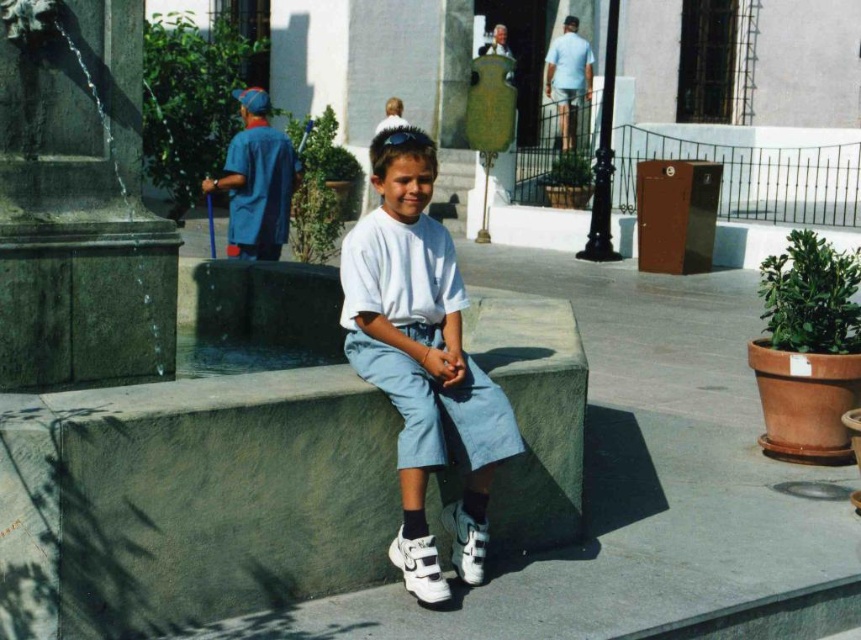
Question: Which object is positioned farthest from the white leather shoe at lower center?

Choices:
 (A) white suede sneaker at lower center
 (B) white matte shorts at center

Answer: (A)

Question: Which object appears farthest from the camera in this image?

Choices:
 (A) white matte shorts at center
 (B) white suede sneaker at lower center
 (C) white leather shoe at lower center

Answer: (B)

Question: Can you confirm if green stone pillar at left is positioned to the left of white suede sneaker at lower center?

Choices:
 (A) yes
 (B) no

Answer: (A)

Question: Is white leather shoe at lower center to the left of white suede sneaker at lower center from the viewer's perspective?

Choices:
 (A) yes
 (B) no

Answer: (A)

Question: Which is nearer to the white suede sneaker at lower center?

Choices:
 (A) white leather shoe at lower center
 (B) green stone pillar at left
 (C) white matte shorts at center

Answer: (C)

Question: Is green stone pillar at left above white suede sneaker at lower center?

Choices:
 (A) no
 (B) yes

Answer: (B)